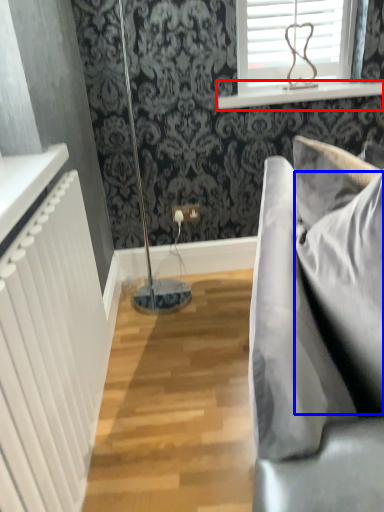
Question: Which of the following is the closest to the observer, window sill (highlighted by a red box) or pillow (highlighted by a blue box)?

Choices:
 (A) window sill
 (B) pillow

Answer: (B)